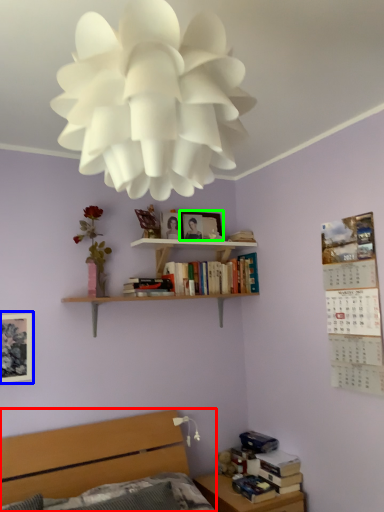
Question: Considering the real-world distances, which object is closest to bed (highlighted by a red box)? picture frame (highlighted by a blue box) or picture frame (highlighted by a green box).

Choices:
 (A) picture frame
 (B) picture frame

Answer: (A)